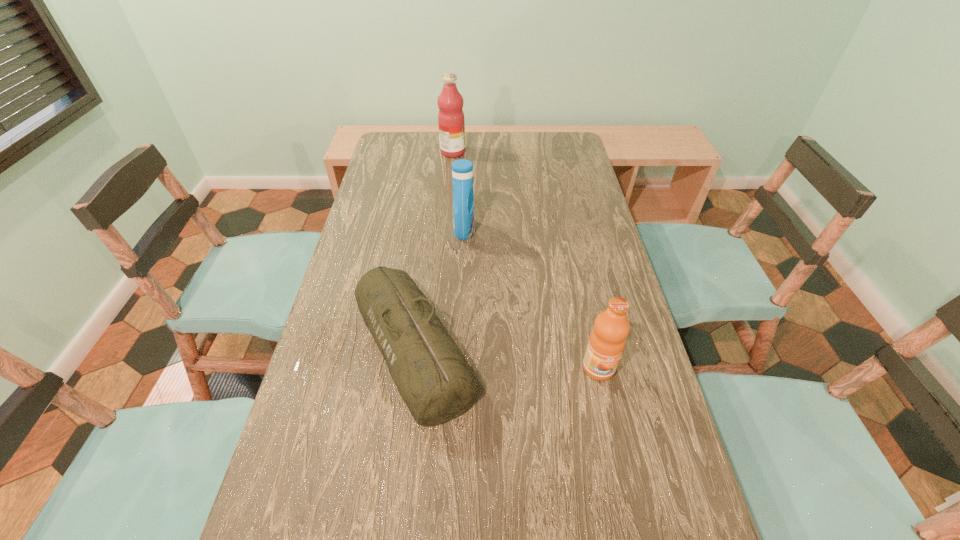
Locate an element on the screen. The image size is (960, 540). the tallest object is located at coordinates (451, 122).

Where is `the left fruit juice`? the left fruit juice is located at coordinates (451, 122).

At what (x,y) coordinates should I click in order to perform the action: click on detergent. Please return your answer as a coordinate pair (x, y). This screenshot has height=540, width=960. Looking at the image, I should click on (462, 170).

Image resolution: width=960 pixels, height=540 pixels. Identify the location of the nearer fruit juice. (607, 340).

Where is `the shorter fruit juice`? the shorter fruit juice is located at coordinates (607, 340).

I want to click on the shortest object, so click(x=436, y=383).

Identify the location of vacant space located on the label of the farther fruit juice. (492, 152).

Find the location of a particular element. This screenshot has width=960, height=540. vacant space positioned on the front-facing side of the second farthest object is located at coordinates (575, 231).

Locate an element on the screen. The width and height of the screenshot is (960, 540). free region located 0.310m on the label side of the rightmost object is located at coordinates (635, 531).

You are a GUI agent. You are given a task and a screenshot of the screen. Output one action in this format:
    pyautogui.click(x=<x>, y=<y>)
    Task: Click on the free location located 0.140m on the back of the duffel bag
    The height and width of the screenshot is (540, 960).
    Given the screenshot: What is the action you would take?
    pyautogui.click(x=425, y=253)